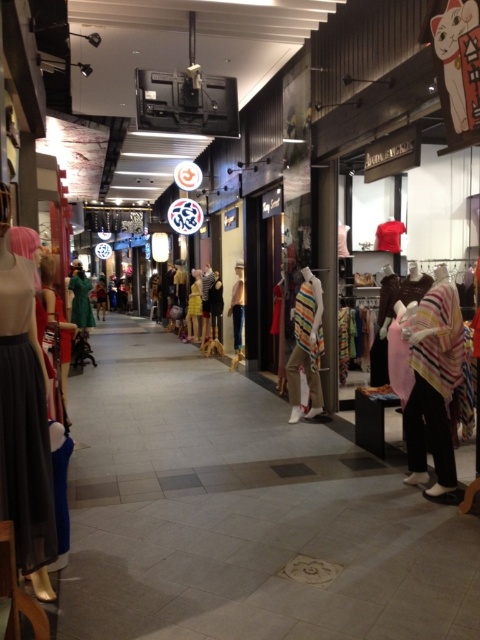
You are a customer in the mall looking at the striped fabric poncho at center and the striped fabric scarf at center displayed outside a clothing store. Which item takes up more space in the display?

The striped fabric poncho at center takes up more space in the display because it is bigger than the striped fabric scarf at center.

You are standing in the shopping arcade and want to take a photo of both point (180, 298) and point (104, 284). Which point will appear larger in your camera view?

Point (180, 298) is closer to the camera than point (104, 284), so it will appear larger in the camera view.

You are a store manager arranging items in the shopping arcade. You have a display stand that can only accommodate items with a width of 30 cm or less. You need to place both the white cotton shirt at center and the striped fabric scarf at center on the stand. Based on their widths, which item should you prioritize placing first?

The white cotton shirt at center has a lesser width compared to the striped fabric scarf at center, so you should prioritize placing the white cotton shirt at center first to ensure it fits within the 30 cm width constraint before attempting the wider scarf.